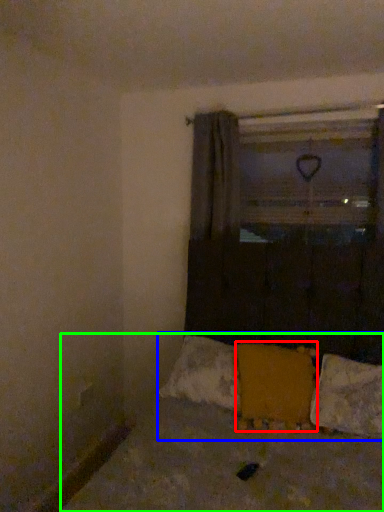
Question: Which is farther away from pillow (highlighted by a red box)? bedding (highlighted by a blue box) or bed (highlighted by a green box)?

Choices:
 (A) bedding
 (B) bed

Answer: (B)